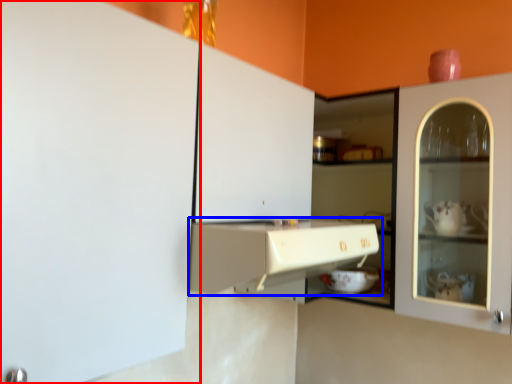
Question: Which object appears closest to the camera in this image, cabinetry (highlighted by a red box) or cabinetry (highlighted by a blue box)?

Choices:
 (A) cabinetry
 (B) cabinetry

Answer: (A)